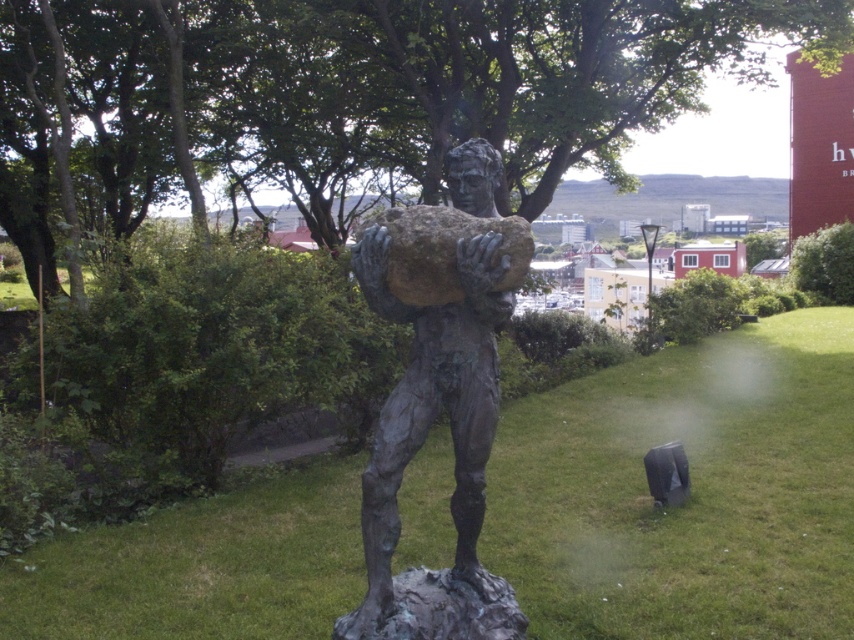
Question: Is green grass at center to the left of bronze statue at center from the viewer's perspective?

Choices:
 (A) yes
 (B) no

Answer: (B)

Question: Does green grass at center appear over bronze statue at center?

Choices:
 (A) yes
 (B) no

Answer: (B)

Question: Which point appears farthest from the camera in this image?

Choices:
 (A) (744, 589)
 (B) (428, 573)

Answer: (A)

Question: Considering the relative positions of green grass at center and bronze statue at center in the image provided, where is green grass at center located with respect to bronze statue at center?

Choices:
 (A) below
 (B) above

Answer: (A)